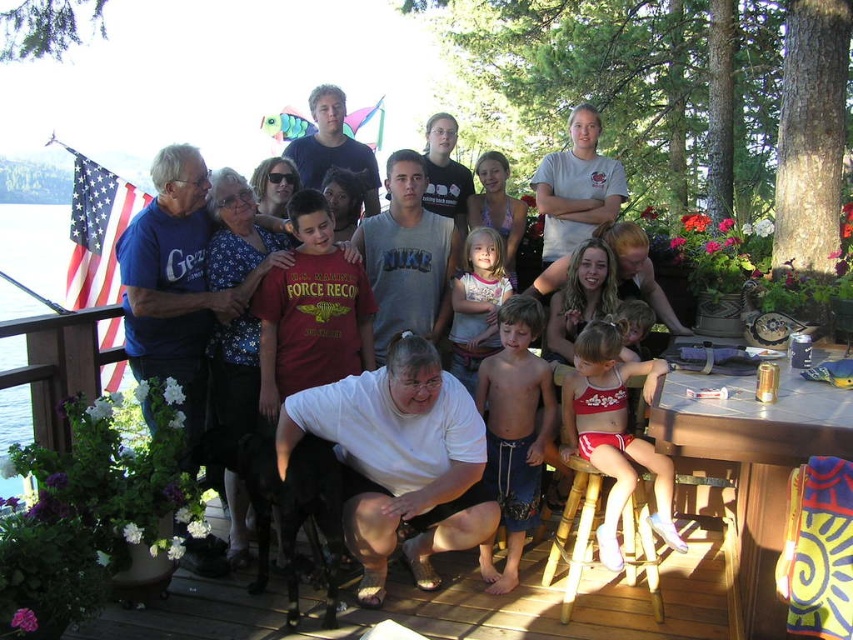
Does wooden deck at center have a greater height compared to bamboo stool at lower center?

In fact, wooden deck at center may be shorter than bamboo stool at lower center.

Does wooden deck at center appear on the left side of bamboo stool at lower center?

Correct, you'll find wooden deck at center to the left of bamboo stool at lower center.

Find the location of a particular element. The image size is (853, 640). wooden deck at center is located at coordinates (456, 604).

Can you confirm if white matte shirt at center is taller than wooden table at lower right?

Yes.

Which is above, white matte shirt at center or wooden table at lower right?

wooden table at lower right

Is point (357, 598) positioned behind point (653, 432)?

Yes, point (357, 598) is farther from viewer.

You are a GUI agent. You are given a task and a screenshot of the screen. Output one action in this format:
    pyautogui.click(x=<x>, y=<y>)
    Task: Click on the white matte shirt at center
    The image size is (853, 640).
    Given the screenshot: What is the action you would take?
    pyautogui.click(x=399, y=460)

Is blue denim shorts at center smaller than striped cotton shirt at center?

Actually, blue denim shorts at center might be larger than striped cotton shirt at center.

Which is more to the right, blue denim shorts at center or striped cotton shirt at center?

From the viewer's perspective, blue denim shorts at center appears more on the right side.

Is point (543, 456) positioned after point (476, 307)?

No, (543, 456) is in front of (476, 307).

This screenshot has width=853, height=640. Identify the location of blue denim shorts at center. (514, 432).